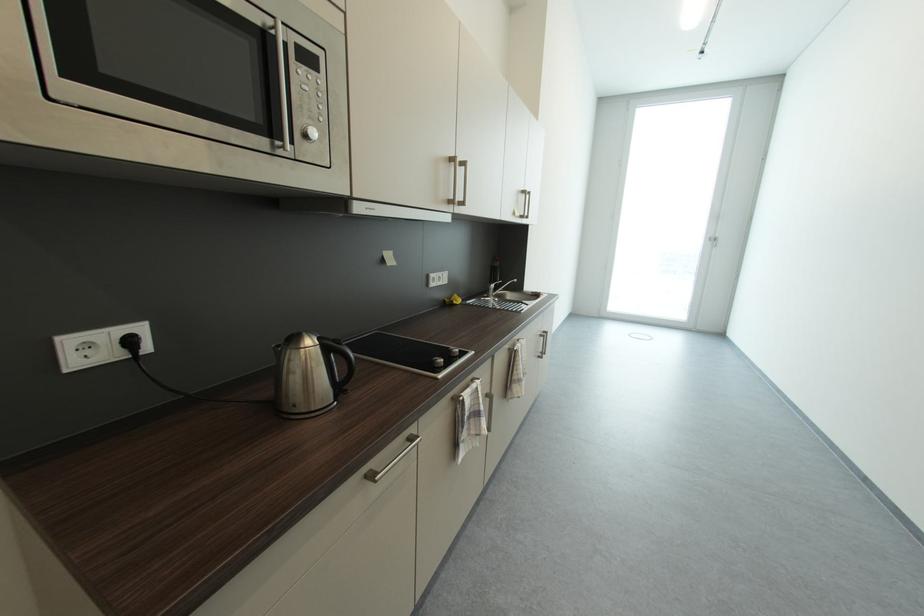
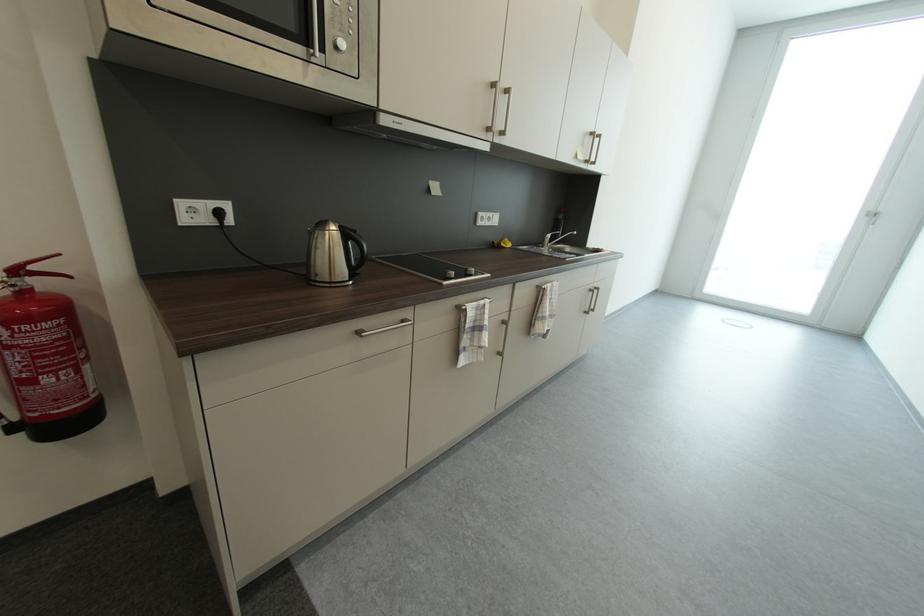
Find the pixel in the second image that matches pixel 317 119 in the first image.

(347, 33)